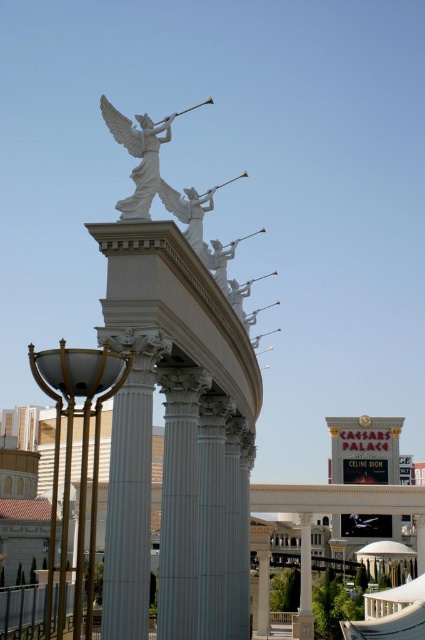
Does gold polished metal lamp post at lower left have a smaller size compared to white marble angel at upper center?

No, gold polished metal lamp post at lower left is not smaller than white marble angel at upper center.

Does gold polished metal lamp post at lower left have a lesser width compared to white marble angel at upper center?

Incorrect, gold polished metal lamp post at lower left's width is not less than white marble angel at upper center's.

Between point (107, 358) and point (172, 115), which one is positioned behind?

The point (172, 115) is more distant.

Find the location of a particular element. gold polished metal lamp post at lower left is located at coordinates (81, 458).